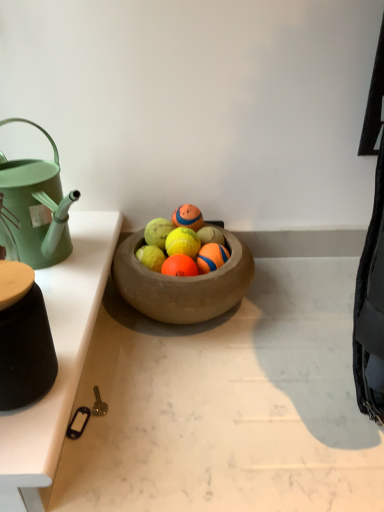
Describe the element at coordinates (179, 266) in the screenshot. I see `orange rubber ball at center, which is counted as the first fruit, starting from the left` at that location.

What do you see at coordinates (182, 242) in the screenshot? I see `yellow rubber tennis ball at center, positioned as the 2th fruit in left-to-right order` at bounding box center [182, 242].

What do you see at coordinates (211, 257) in the screenshot?
I see `orange rubber ball at center, acting as the first fruit starting from the right` at bounding box center [211, 257].

The width and height of the screenshot is (384, 512). Identify the location of orange rubber ball at center, which is counted as the first fruit, starting from the left. (179, 266).

Considering the relative positions of yellow rubber tennis ball at center, the 2th fruit when ordered from right to left, and rubber textured tennis ball at center in the image provided, is yellow rubber tennis ball at center, the 2th fruit when ordered from right to left, to the left or to the right of rubber textured tennis ball at center?

From the image, it's evident that yellow rubber tennis ball at center, the 2th fruit when ordered from right to left, is to the left of rubber textured tennis ball at center.

Are yellow rubber tennis ball at center, positioned as the 2th fruit in left-to-right order, and rubber textured tennis ball at center far apart?

Actually, yellow rubber tennis ball at center, positioned as the 2th fruit in left-to-right order, and rubber textured tennis ball at center are a little close together.

From a real-world perspective, between yellow rubber tennis ball at center, the 2th fruit when ordered from right to left, and rubber textured tennis ball at center, who is vertically lower?

yellow rubber tennis ball at center, the 2th fruit when ordered from right to left, from a real-world perspective.

Can you confirm if white glossy table at left is wider than orange rubber ball at center, acting as the first fruit starting from the right?

Yes.

Could you measure the distance between white glossy table at left and orange rubber ball at center, positioned as the third fruit in left-to-right order?

white glossy table at left is 26.90 centimeters away from orange rubber ball at center, positioned as the third fruit in left-to-right order.

Which is more to the right, white glossy table at left or orange rubber ball at center, acting as the first fruit starting from the right?

orange rubber ball at center, acting as the first fruit starting from the right.

Are white glossy table at left and orange rubber ball at center, positioned as the third fruit in left-to-right order, located far from each other?

That's not correct — white glossy table at left is a little close to orange rubber ball at center, positioned as the third fruit in left-to-right order.

Based on their sizes in the image, would you say orange rubber ball at center, which is counted as the first fruit, starting from the left, is bigger or smaller than orange rubber ball at center, positioned as the third fruit in left-to-right order?

orange rubber ball at center, which is counted as the first fruit, starting from the left, is bigger than orange rubber ball at center, positioned as the third fruit in left-to-right order.

From the picture: How many degrees apart are the facing directions of orange rubber ball at center, the 3th fruit from the right, and orange rubber ball at center, acting as the first fruit starting from the right?

0.000139 degrees separate the facing orientations of orange rubber ball at center, the 3th fruit from the right, and orange rubber ball at center, acting as the first fruit starting from the right.

Does orange rubber ball at center, the 3th fruit from the right, contain orange rubber ball at center, acting as the first fruit starting from the right?

No, orange rubber ball at center, the 3th fruit from the right, does not contain orange rubber ball at center, acting as the first fruit starting from the right.

Which object is positioned more to the left, orange rubber ball at center, which is counted as the first fruit, starting from the left, or orange rubber ball at center, acting as the first fruit starting from the right?

Positioned to the left is orange rubber ball at center, which is counted as the first fruit, starting from the left.

Is yellow rubber tennis ball at center, positioned as the 2th fruit in left-to-right order, completely or partially outside of orange rubber ball at center, the 3th fruit from the right?

yellow rubber tennis ball at center, positioned as the 2th fruit in left-to-right order, lies outside orange rubber ball at center, the 3th fruit from the right,'s area.

Between point (178, 248) and point (193, 273), which one is positioned in front?

The point (193, 273) is in front.

Looking at this image, from the image's perspective, relative to orange rubber ball at center, the 3th fruit from the right, is yellow rubber tennis ball at center, positioned as the 2th fruit in left-to-right order, above or below?

yellow rubber tennis ball at center, positioned as the 2th fruit in left-to-right order, is situated higher than orange rubber ball at center, the 3th fruit from the right, in the image.

Which of these two, yellow rubber tennis ball at center, positioned as the 2th fruit in left-to-right order, or orange rubber ball at center, which is counted as the first fruit, starting from the left, stands shorter?

With less height is orange rubber ball at center, which is counted as the first fruit, starting from the left.

Is rubber textured tennis ball at center in contact with orange rubber ball at center, acting as the first fruit starting from the right?

Yes, rubber textured tennis ball at center and orange rubber ball at center, acting as the first fruit starting from the right, clearly make contact.

In the scene shown: Which is behind, rubber textured tennis ball at center or orange rubber ball at center, acting as the first fruit starting from the right?

rubber textured tennis ball at center.

From the image's perspective, does rubber textured tennis ball at center appear higher than orange rubber ball at center, positioned as the third fruit in left-to-right order?

Yes, from the image's perspective, rubber textured tennis ball at center is over orange rubber ball at center, positioned as the third fruit in left-to-right order.

Based on the photo, is the depth of rubber textured tennis ball at center greater than that of yellow rubber tennis ball at center, positioned as the 2th fruit in left-to-right order?

Yes, rubber textured tennis ball at center is further from the camera.

Which object is positioned more to the right, rubber textured tennis ball at center or yellow rubber tennis ball at center, the 2th fruit when ordered from right to left?

Positioned to the right is rubber textured tennis ball at center.

From the picture: Can you tell me how much rubber textured tennis ball at center and yellow rubber tennis ball at center, the 2th fruit when ordered from right to left, differ in facing direction?

The angular difference between rubber textured tennis ball at center and yellow rubber tennis ball at center, the 2th fruit when ordered from right to left, is 6.33e-05 degrees.

Considering the sizes of objects rubber textured tennis ball at center and yellow rubber tennis ball at center, positioned as the 2th fruit in left-to-right order, in the image provided, who is shorter, rubber textured tennis ball at center or yellow rubber tennis ball at center, positioned as the 2th fruit in left-to-right order,?

Standing shorter between the two is rubber textured tennis ball at center.

From a real-world perspective, which object rests below the other?

orange rubber ball at center, acting as the first fruit starting from the right, is physically lower.

Is orange rubber ball at center, acting as the first fruit starting from the right, wider or thinner than yellow rubber tennis ball at center, positioned as the 2th fruit in left-to-right order?

Considering their sizes, orange rubber ball at center, acting as the first fruit starting from the right, looks slimmer than yellow rubber tennis ball at center, positioned as the 2th fruit in left-to-right order.

Could you tell me if orange rubber ball at center, acting as the first fruit starting from the right, is facing yellow rubber tennis ball at center, positioned as the 2th fruit in left-to-right order?

No, orange rubber ball at center, acting as the first fruit starting from the right, does not turn towards yellow rubber tennis ball at center, positioned as the 2th fruit in left-to-right order.

Between orange rubber ball at center, positioned as the third fruit in left-to-right order, and yellow rubber tennis ball at center, positioned as the 2th fruit in left-to-right order, which one is positioned in front?

Positioned in front is orange rubber ball at center, positioned as the third fruit in left-to-right order.

Identify the location of tennis ball that is on the right side of yellow rubber tennis ball at center, the 2th fruit when ordered from right to left. This screenshot has width=384, height=512. (188, 217).

Find the location of `table beneath the orange rubber ball at center, positioned as the third fruit in left-to-right order (from a real-world perspective)`. table beneath the orange rubber ball at center, positioned as the third fruit in left-to-right order (from a real-world perspective) is located at coordinates (58, 362).

Considering their positions, is rubber textured tennis ball at center positioned further to orange rubber ball at center, positioned as the third fruit in left-to-right order, than yellow rubber tennis ball at center, the 2th fruit when ordered from right to left?

Based on the image, rubber textured tennis ball at center appears to be further to orange rubber ball at center, positioned as the third fruit in left-to-right order.

Considering their positions, is white glossy table at left positioned further to yellow rubber tennis ball at center, the 2th fruit when ordered from right to left, than orange rubber ball at center, the 3th fruit from the right?

Based on the image, white glossy table at left appears to be further to yellow rubber tennis ball at center, the 2th fruit when ordered from right to left.

Based on their spatial positions, is yellow rubber tennis ball at center, positioned as the 2th fruit in left-to-right order, or orange rubber ball at center, acting as the first fruit starting from the right, closer to white glossy table at left?

yellow rubber tennis ball at center, positioned as the 2th fruit in left-to-right order, lies closer to white glossy table at left than the other object.

Which object lies further to the anchor point yellow rubber tennis ball at center, positioned as the 2th fruit in left-to-right order, orange rubber ball at center, acting as the first fruit starting from the right, or white glossy table at left?

The object further to yellow rubber tennis ball at center, positioned as the 2th fruit in left-to-right order, is white glossy table at left.

Looking at the image, which one is located closer to rubber textured tennis ball at center, orange rubber ball at center, which is counted as the first fruit, starting from the left, or yellow rubber tennis ball at center, the 2th fruit when ordered from right to left?

yellow rubber tennis ball at center, the 2th fruit when ordered from right to left, lies closer to rubber textured tennis ball at center than the other object.

From the image, which object appears to be farther from yellow rubber tennis ball at center, positioned as the 2th fruit in left-to-right order, rubber textured tennis ball at center or orange rubber ball at center, acting as the first fruit starting from the right?

Based on the image, rubber textured tennis ball at center appears to be further to yellow rubber tennis ball at center, positioned as the 2th fruit in left-to-right order.

When comparing their distances from orange rubber ball at center, the 3th fruit from the right, does orange rubber ball at center, acting as the first fruit starting from the right, or white glossy table at left seem further?

white glossy table at left.

Based on their spatial positions, is yellow rubber tennis ball at center, the 2th fruit when ordered from right to left, or white glossy table at left closer to orange rubber ball at center, acting as the first fruit starting from the right?

yellow rubber tennis ball at center, the 2th fruit when ordered from right to left, lies closer to orange rubber ball at center, acting as the first fruit starting from the right, than the other object.

Locate an element on the screen. Image resolution: width=384 pixels, height=512 pixels. fruit situated between orange rubber ball at center, the 3th fruit from the right, and orange rubber ball at center, positioned as the third fruit in left-to-right order, from left to right is located at coordinates (182, 242).

The image size is (384, 512). I want to click on fruit that lies between rubber textured tennis ball at center and orange rubber ball at center, positioned as the third fruit in left-to-right order, from top to bottom, so click(x=182, y=242).

Image resolution: width=384 pixels, height=512 pixels. What are the coordinates of `fruit between white glossy table at left and orange rubber ball at center, positioned as the third fruit in left-to-right order, in the front-back direction` in the screenshot? It's located at (179, 266).